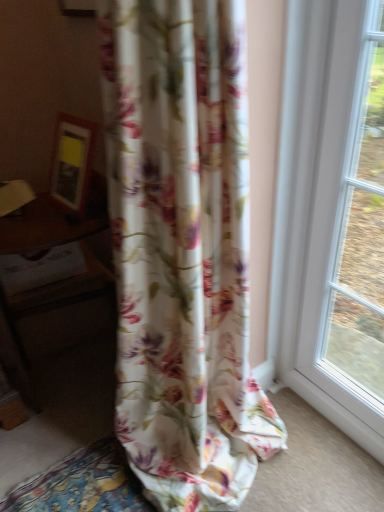
This screenshot has height=512, width=384. What are the coordinates of `free space that is to the left of floral fabric curtain at center` in the screenshot? It's located at (63, 463).